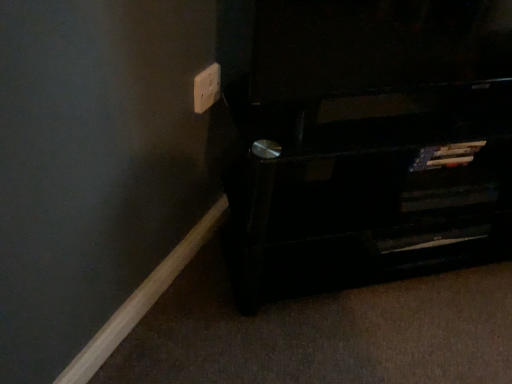
Question: Is white plastic electric outlet at upper center to the left or to the right of black wood shelf at lower right in the image?

Choices:
 (A) left
 (B) right

Answer: (A)

Question: Is white plastic electric outlet at upper center wider or thinner than black wood shelf at lower right?

Choices:
 (A) wide
 (B) thin

Answer: (B)

Question: From a real-world perspective, is white plastic electric outlet at upper center positioned above or below black wood shelf at lower right?

Choices:
 (A) above
 (B) below

Answer: (A)

Question: Would you say black wood shelf at lower right is to the left or to the right of white plastic electric outlet at upper center in the picture?

Choices:
 (A) right
 (B) left

Answer: (A)

Question: Is black wood shelf at lower right situated inside white plastic electric outlet at upper center or outside?

Choices:
 (A) outside
 (B) inside

Answer: (A)

Question: Does point (241, 152) appear closer or farther from the camera than point (214, 71)?

Choices:
 (A) closer
 (B) farther

Answer: (B)

Question: In terms of size, does black wood shelf at lower right appear bigger or smaller than white plastic electric outlet at upper center?

Choices:
 (A) big
 (B) small

Answer: (A)